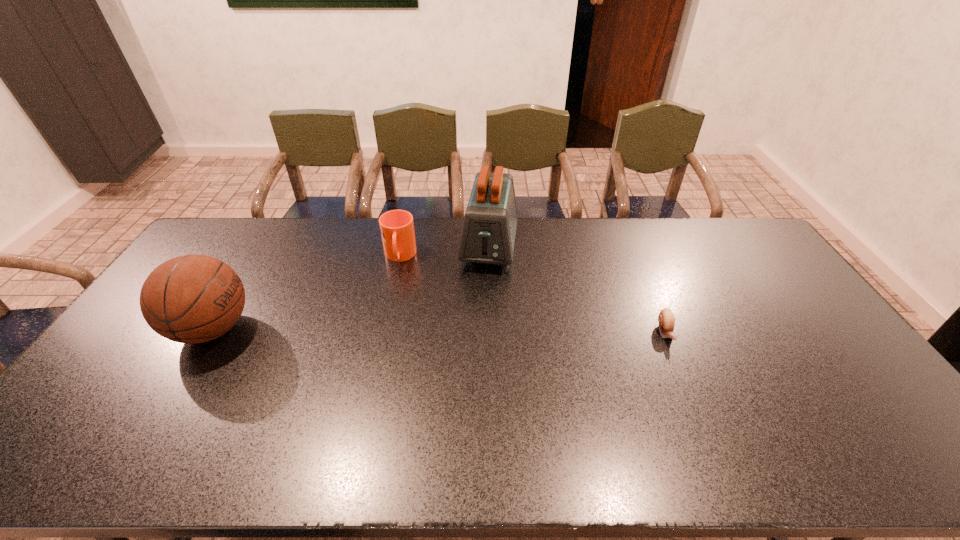
Locate an element on the screen. The width and height of the screenshot is (960, 540). free space on the desktop that is between the second tallest object and the escargot and is positioned on the handle side of the second shortest object is located at coordinates (396, 330).

Where is `vacant space on the desktop that is between the basketball and the escargot and is positioned on the front-facing side of the second object from right to left`? vacant space on the desktop that is between the basketball and the escargot and is positioned on the front-facing side of the second object from right to left is located at coordinates (473, 331).